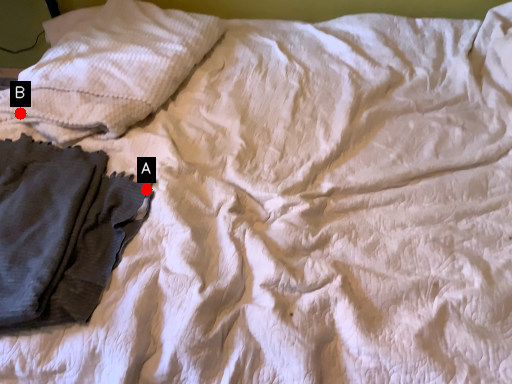
Question: Two points are circled on the image, labeled by A and B beside each circle. Which point is closer to the camera taking this photo?

Choices:
 (A) A is closer
 (B) B is closer

Answer: (A)